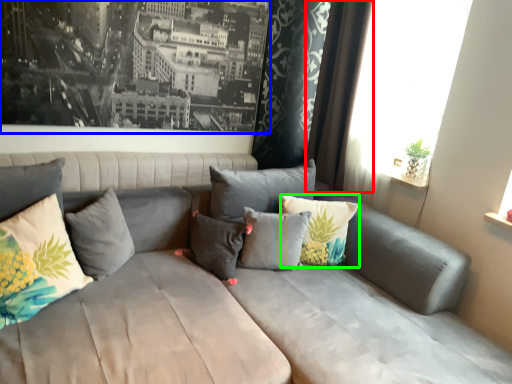
Question: Estimate the real-world distances between objects in this image. Which object is closer to curtain (highlighted by a red box), picture frame (highlighted by a blue box) or pillow (highlighted by a green box)?

Choices:
 (A) picture frame
 (B) pillow

Answer: (B)